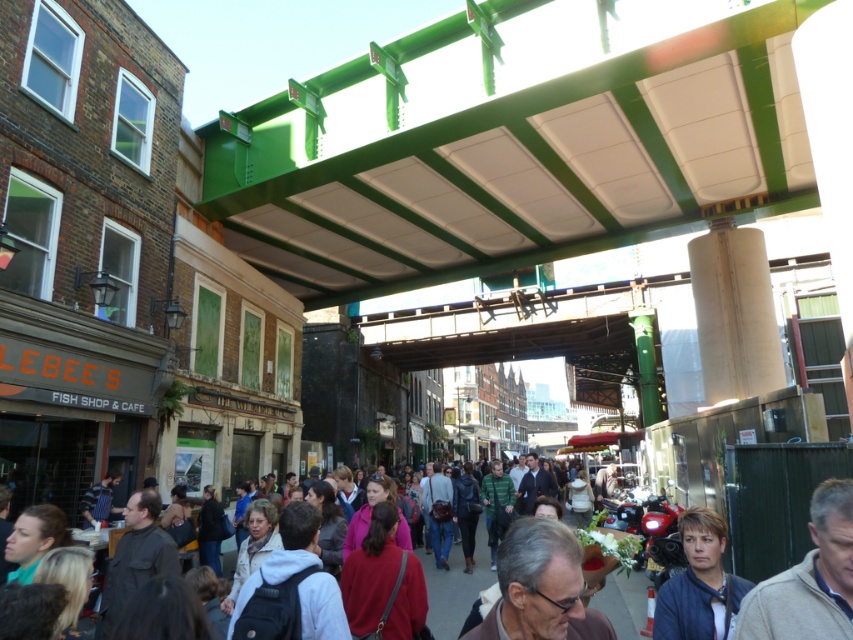
You are a photographer trying to capture a candid shot of the light brown leather jacket at lower right and the dark blue jacket at lower right. Since you want both jackets to be clearly visible in the frame, which jacket should you adjust your focus to prioritize based on their sizes?

The light brown leather jacket at lower right occupies less space than the dark blue jacket at lower right, so you should prioritize focusing on the dark blue jacket at lower right to ensure it remains clear in the photo.

You are a photographer trying to capture a photo of the LEBEE S FISH SHOP CAFE sign. You notice two jackets, a light brown leather jacket at lower right and a dark blue jacket at lower right, blocking your view. Which jacket is wider and might be causing more obstruction?

The dark blue jacket at lower right is wider than the light brown leather jacket at lower right, so it might be causing more obstruction.